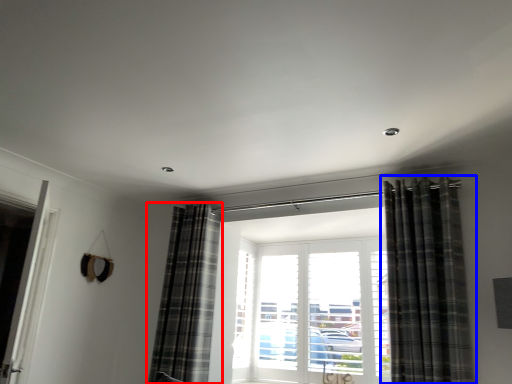
Question: Which object is further to the camera taking this photo, curtain (highlighted by a red box) or curtain (highlighted by a blue box)?

Choices:
 (A) curtain
 (B) curtain

Answer: (A)